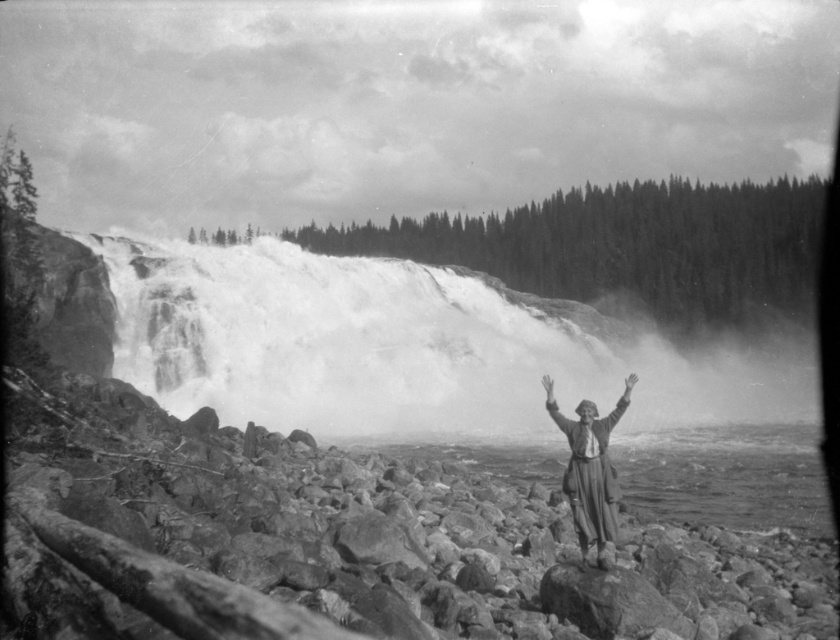
You are standing at the edge of the waterfall and want to place a small statue exactly at the center of the image. According to the coordinates provided, where should you place it relative to the smooth rock at center?

The smooth rock at center is already located at the coordinates point (349, 545), so placing the statue at the center would mean placing it at the same coordinates as the smooth rock at center.

You are a hiker trying to balance on the smooth rock at center. Your arm is extended to the smooth skin arm at center for support. Can your arm reach the ground to help stabilize yourself?

The smooth rock at center is taller than the smooth skin arm at center, so the arm cannot reach the ground to stabilize you.